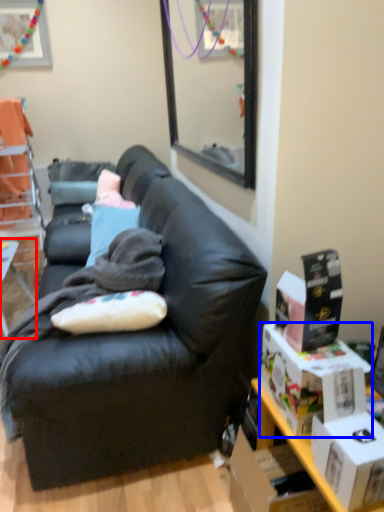
Question: Which point is further to the camera, table (highlighted by a red box) or box (highlighted by a blue box)?

Choices:
 (A) table
 (B) box

Answer: (A)